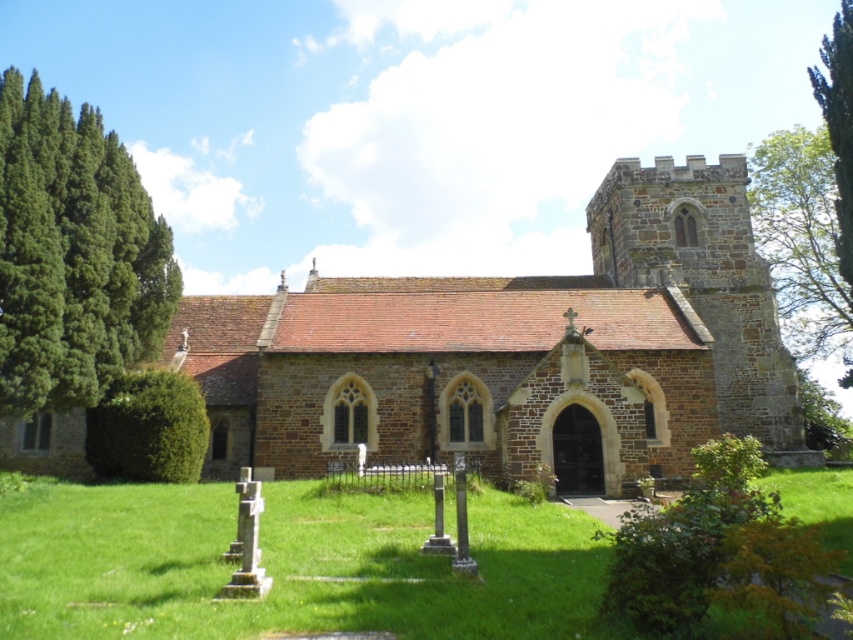
Question: Considering the real-world distances, which object is closest to the green leafy tree at upper right?

Choices:
 (A) green coniferous tree at left
 (B) brown stone church at center

Answer: (B)

Question: Can you confirm if green coniferous tree at left is positioned to the right of green leafy tree at upper right?

Choices:
 (A) yes
 (B) no

Answer: (B)

Question: Which point is closer to the camera?

Choices:
 (A) brown stone church at center
 (B) green coniferous tree at left
 (C) green leafy tree at upper right

Answer: (B)

Question: Does brown stone church at center have a larger size compared to green coniferous tree at left?

Choices:
 (A) no
 (B) yes

Answer: (B)

Question: Which point is farther from the camera taking this photo?

Choices:
 (A) (780, 307)
 (B) (682, 371)

Answer: (A)

Question: Does green coniferous tree at left appear on the left side of green leafy tree at upper right?

Choices:
 (A) no
 (B) yes

Answer: (B)